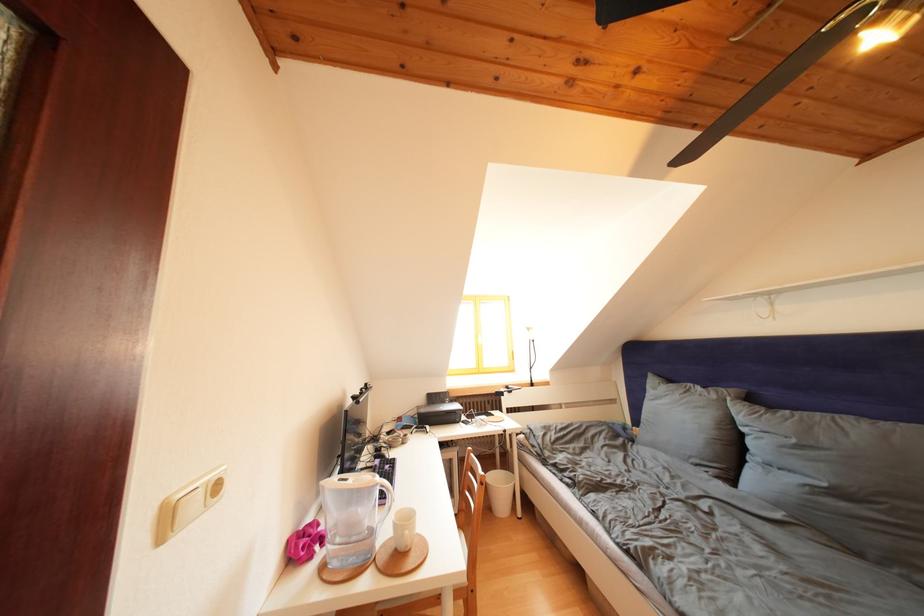
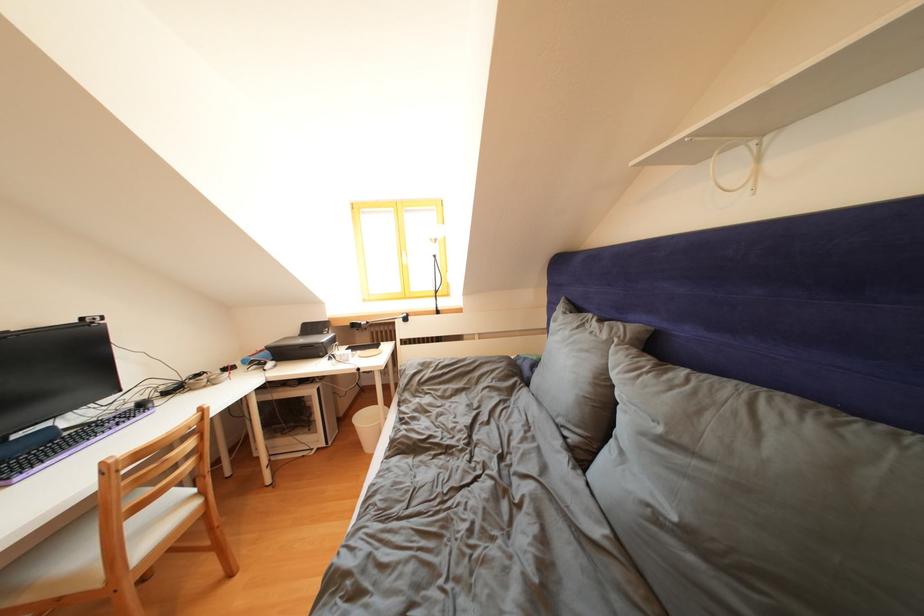
Where in the second image is the point corresponding to the point at 801,446 from the first image?

(667, 435)